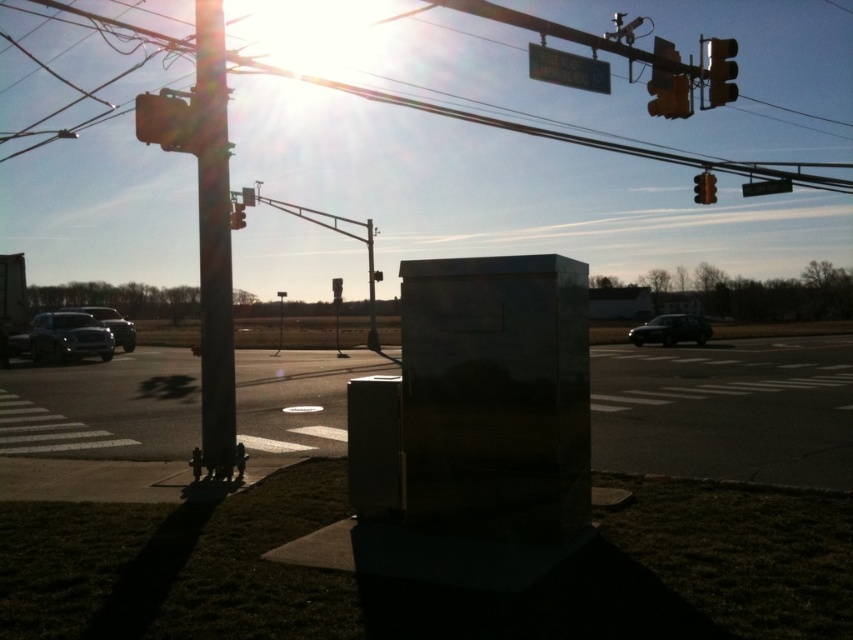
Question: Is metallic wire at upper center further to camera compared to metallic street sign at upper center?

Choices:
 (A) no
 (B) yes

Answer: (A)

Question: Which object is positioned farthest from the metallic pole at center?

Choices:
 (A) metallic traffic light at upper right
 (B) shiny silver sedan at left
 (C) metallic pole at left
 (D) matte black truck at left

Answer: (A)

Question: Which point is closer to the camera?

Choices:
 (A) (741, 182)
 (B) (120, 321)

Answer: (B)

Question: Is metallic sign at center positioned before shiny black sedan at center?

Choices:
 (A) yes
 (B) no

Answer: (A)

Question: Observing the image, what is the correct spatial positioning of metallic pole at center in reference to metallic orange traffic light at upper right?

Choices:
 (A) left
 (B) right

Answer: (A)

Question: Considering the real-world distances, which object is closest to the metallic pole at left?

Choices:
 (A) metallic orange traffic light at upper right
 (B) metallic at upper center

Answer: (B)